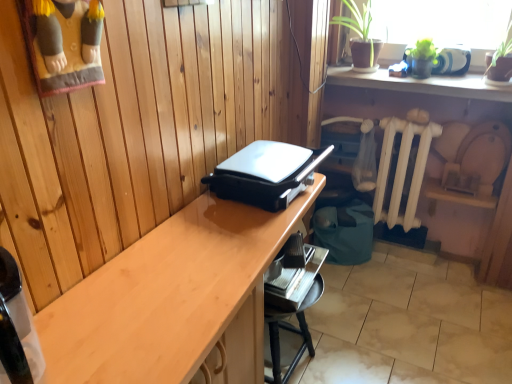
The image size is (512, 384). Describe the element at coordinates (174, 300) in the screenshot. I see `light wood desk at center` at that location.

What do you see at coordinates (266, 174) in the screenshot?
I see `black plastic waffle iron at center` at bounding box center [266, 174].

This screenshot has height=384, width=512. I want to click on light wood desk at center, so click(174, 300).

Is white painted metal radiator at lower right bigger than black plastic waffle iron at center?

Yes.

Where is `appliance on the left of white painted metal radiator at lower right`? This screenshot has width=512, height=384. appliance on the left of white painted metal radiator at lower right is located at coordinates (266, 174).

From a real-world perspective, is white painted metal radiator at lower right above or below black plastic waffle iron at center?

white painted metal radiator at lower right is below black plastic waffle iron at center.

Are green matte shelf at upper right and light wood desk at center far apart?

That's right, there is a large distance between green matte shelf at upper right and light wood desk at center.

Between green matte shelf at upper right and light wood desk at center, which one has more height?

Standing taller between the two is light wood desk at center.

From the image's perspective, is green matte shelf at upper right located beneath light wood desk at center?

No, from the image's perspective, green matte shelf at upper right is not beneath light wood desk at center.

Considering the relative sizes of green matte shelf at upper right and light wood desk at center in the image provided, is green matte shelf at upper right smaller than light wood desk at center?

Correct, green matte shelf at upper right occupies less space than light wood desk at center.

How different are the orientations of green matte shelf at upper right and white painted metal radiator at lower right in degrees?

The angular difference between green matte shelf at upper right and white painted metal radiator at lower right is 2.36 degrees.

Is green matte shelf at upper right outside of white painted metal radiator at lower right?

Yes.

In order to click on radiator that appears below the green matte shelf at upper right (from a real-world perspective) in this screenshot , I will do `click(402, 170)`.

How distant is green matte shelf at upper right from white painted metal radiator at lower right?

33.07 centimeters.

Would you consider black plastic waffle iron at center to be distant from green matte shelf at upper right?

No, black plastic waffle iron at center is not far away from green matte shelf at upper right.

Is point (276, 180) closer to camera compared to point (462, 86)?

Yes, point (276, 180) is closer to viewer.

Can you tell me how much black plastic waffle iron at center and green matte shelf at upper right differ in facing direction?

The facing directions of black plastic waffle iron at center and green matte shelf at upper right are 88.2 degrees apart.

From the image's perspective, who appears lower, black plastic waffle iron at center or green matte shelf at upper right?

From the image's view, black plastic waffle iron at center is below.

Which is in front, light wood desk at center or white painted metal radiator at lower right?

light wood desk at center.

Could you tell me if light wood desk at center is turned towards white painted metal radiator at lower right?

No, light wood desk at center does not turn towards white painted metal radiator at lower right.

Where is `desk in front of the white painted metal radiator at lower right`? desk in front of the white painted metal radiator at lower right is located at coordinates (174, 300).

Which is in front, point (104, 309) or point (399, 205)?

The point (104, 309) is in front.

Looking at this image, is light wood desk at center positioned in front of green matte shelf at upper right?

That is True.

Based on their positions, is light wood desk at center located to the left or right of green matte shelf at upper right?

light wood desk at center is positioned on green matte shelf at upper right's left side.

Considering the positions of points (123, 258) and (386, 72), is point (123, 258) farther from camera compared to point (386, 72)?

No, (123, 258) is in front of (386, 72).

How much distance is there between light wood desk at center and green matte shelf at upper right?

light wood desk at center and green matte shelf at upper right are 1.23 meters apart from each other.

From the image's perspective, is green matte shelf at upper right below black plastic waffle iron at center?

No.

Is black plastic waffle iron at center inside green matte shelf at upper right?

No, black plastic waffle iron at center is located outside of green matte shelf at upper right.

Could you tell me if green matte shelf at upper right is facing black plastic waffle iron at center?

Yes, green matte shelf at upper right faces towards black plastic waffle iron at center.

Find the location of a particular element. radiator lying below the black plastic waffle iron at center (from the image's perspective) is located at coordinates [x=402, y=170].

This screenshot has height=384, width=512. In order to click on desk on the left of the green matte shelf at upper right in this screenshot , I will do `click(174, 300)`.

Looking at the image, which one is located closer to green matte shelf at upper right, light wood desk at center or white painted metal radiator at lower right?

Among the two, white painted metal radiator at lower right is located nearer to green matte shelf at upper right.

Based on their spatial positions, is light wood desk at center or green matte shelf at upper right closer to black plastic waffle iron at center?

light wood desk at center.

From the image, which object appears to be nearer to white painted metal radiator at lower right, green matte shelf at upper right or black plastic waffle iron at center?

green matte shelf at upper right is positioned closer to the anchor white painted metal radiator at lower right.

From the image, which object appears to be nearer to green matte shelf at upper right, black plastic waffle iron at center or white painted metal radiator at lower right?

white painted metal radiator at lower right is positioned closer to the anchor green matte shelf at upper right.

Which object lies nearer to the anchor point black plastic waffle iron at center, white painted metal radiator at lower right or green matte shelf at upper right?

Based on the image, green matte shelf at upper right appears to be nearer to black plastic waffle iron at center.

From the image, which object appears to be farther from green matte shelf at upper right, black plastic waffle iron at center or light wood desk at center?

Based on the image, light wood desk at center appears to be further to green matte shelf at upper right.

Consider the image. When comparing their distances from light wood desk at center, does white painted metal radiator at lower right or green matte shelf at upper right seem closer?

Based on the image, white painted metal radiator at lower right appears to be nearer to light wood desk at center.

Looking at the image, which one is located further to white painted metal radiator at lower right, black plastic waffle iron at center or light wood desk at center?

light wood desk at center.

Where is `appliance positioned between light wood desk at center and green matte shelf at upper right from near to far`? The image size is (512, 384). appliance positioned between light wood desk at center and green matte shelf at upper right from near to far is located at coordinates (266, 174).

I want to click on shelf located between black plastic waffle iron at center and white painted metal radiator at lower right in the left-right direction, so click(x=420, y=84).

Find the location of a particular element. This screenshot has height=384, width=512. appliance positioned between light wood desk at center and white painted metal radiator at lower right from near to far is located at coordinates click(x=266, y=174).

Image resolution: width=512 pixels, height=384 pixels. I want to click on shelf located between light wood desk at center and white painted metal radiator at lower right in the depth direction, so click(420, 84).